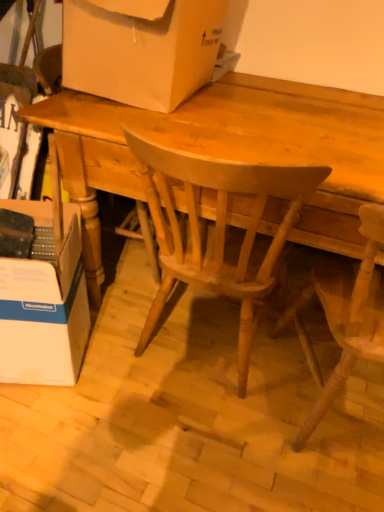
You are a GUI agent. You are given a task and a screenshot of the screen. Output one action in this format:
    pyautogui.click(x=<x>, y=<y>)
    Task: Click on the white cardboard box at left, which is counted as the 1th box, starting from the bottom
    
    Given the screenshot: What is the action you would take?
    pyautogui.click(x=44, y=294)

Measure the distance between point (360, 335) and camera.

Point (360, 335) is 1.08 meters away from camera.

Locate an element on the screen. wooden chair at center, which appears as the second chair when viewed from the left is located at coordinates click(346, 312).

At what (x,y) coordinates should I click in order to perform the action: click on light brown wood chair at center, the first chair viewed from the left. Please return your answer as a coordinate pair (x, y). Looking at the image, I should click on (216, 230).

Is wooden desk at center directly adjacent to white cardboard box at left, which is counted as the 1th box, starting from the bottom?

No.

Between wooden desk at center and white cardboard box at left, which is counted as the 1th box, starting from the bottom, which one is positioned in front?

Positioned in front is wooden desk at center.

Is wooden desk at center taller or shorter than white cardboard box at left, the second box positioned from the top?

Considering their sizes, wooden desk at center has more height than white cardboard box at left, the second box positioned from the top.

Can you confirm if wooden desk at center is positioned to the left of wooden chair at center, which appears as the second chair when viewed from the left?

Indeed, wooden desk at center is positioned on the left side of wooden chair at center, which appears as the second chair when viewed from the left.

From the image's perspective, would you say wooden desk at center is shown under wooden chair at center, which appears as the second chair when viewed from the left?

Actually, wooden desk at center appears above wooden chair at center, which appears as the second chair when viewed from the left, in the image.

Between wooden desk at center and wooden chair at center, arranged as the first chair when viewed from the right, which one is positioned behind?

Positioned behind is wooden desk at center.

Is wooden desk at center with wooden chair at center, arranged as the first chair when viewed from the right?

No.

Considering the relative sizes of wooden chair at center, which appears as the second chair when viewed from the left, and matte cardboard box at upper center, which is the first box in top-to-bottom order, in the image provided, is wooden chair at center, which appears as the second chair when viewed from the left, thinner than matte cardboard box at upper center, which is the first box in top-to-bottom order,?

In fact, wooden chair at center, which appears as the second chair when viewed from the left, might be wider than matte cardboard box at upper center, which is the first box in top-to-bottom order.

From a real-world perspective, is wooden chair at center, arranged as the first chair when viewed from the right, positioned over matte cardboard box at upper center, which is the first box in top-to-bottom order, based on gravity?

No, from a real-world perspective, wooden chair at center, arranged as the first chair when viewed from the right, is not on top of matte cardboard box at upper center, which is the first box in top-to-bottom order.

Which is closer to the camera, (365, 275) or (167, 88)?

Point (365, 275) is closer to the camera than point (167, 88).

Is wooden chair at center, which appears as the second chair when viewed from the left, bigger than matte cardboard box at upper center, acting as the second box starting from the bottom?

Yes.

Could you tell me if wooden desk at center is turned towards matte cardboard box at upper center, which is the first box in top-to-bottom order?

No, wooden desk at center does not turn towards matte cardboard box at upper center, which is the first box in top-to-bottom order.

Is matte cardboard box at upper center, which is the first box in top-to-bottom order, a part of wooden desk at center?

No, matte cardboard box at upper center, which is the first box in top-to-bottom order, is located outside of wooden desk at center.

Based on their positions, is wooden desk at center located to the left or right of matte cardboard box at upper center, which is the first box in top-to-bottom order?

In the image, wooden desk at center appears on the right side of matte cardboard box at upper center, which is the first box in top-to-bottom order.

Does point (281, 240) come farther from viewer compared to point (220, 115)?

That is False.

Are light brown wood chair at center, which appears as the second chair when viewed from the right, and wooden desk at center beside each other?

No, light brown wood chair at center, which appears as the second chair when viewed from the right, is not beside wooden desk at center.

This screenshot has height=512, width=384. I want to click on the 1st chair in front of the wooden desk at center, starting your count from the anchor, so click(216, 230).

Could you tell me if light brown wood chair at center, the first chair viewed from the left, is turned towards wooden desk at center?

Yes, light brown wood chair at center, the first chair viewed from the left, faces towards wooden desk at center.

Can you see matte cardboard box at upper center, acting as the second box starting from the bottom, touching wooden chair at center, which appears as the second chair when viewed from the left?

No, matte cardboard box at upper center, acting as the second box starting from the bottom, is not with wooden chair at center, which appears as the second chair when viewed from the left.

From the image's perspective, relative to wooden chair at center, which appears as the second chair when viewed from the left, is matte cardboard box at upper center, acting as the second box starting from the bottom, above or below?

Based on their image positions, matte cardboard box at upper center, acting as the second box starting from the bottom, is located above wooden chair at center, which appears as the second chair when viewed from the left.

Would you say matte cardboard box at upper center, acting as the second box starting from the bottom, is inside or outside wooden chair at center, which appears as the second chair when viewed from the left?

matte cardboard box at upper center, acting as the second box starting from the bottom, cannot be found inside wooden chair at center, which appears as the second chair when viewed from the left.

From the image's perspective, which object appears higher, matte cardboard box at upper center, which is the first box in top-to-bottom order, or light brown wood chair at center, the first chair viewed from the left?

matte cardboard box at upper center, which is the first box in top-to-bottom order, from the image's perspective.

Does matte cardboard box at upper center, acting as the second box starting from the bottom, have a larger size compared to light brown wood chair at center, which appears as the second chair when viewed from the right?

Actually, matte cardboard box at upper center, acting as the second box starting from the bottom, might be smaller than light brown wood chair at center, which appears as the second chair when viewed from the right.

Is matte cardboard box at upper center, acting as the second box starting from the bottom, positioned with its back to light brown wood chair at center, which appears as the second chair when viewed from the right?

That's not correct — matte cardboard box at upper center, acting as the second box starting from the bottom, is not looking away from light brown wood chair at center, which appears as the second chair when viewed from the right.

At what (x,y) coordinates should I click in order to perform the action: click on desk on the right of the white cardboard box at left, which is counted as the 1th box, starting from the bottom. Please return your answer as a coordinate pair (x, y). Looking at the image, I should click on (228, 149).

From a real-world perspective, starting from the wooden desk at center, which chair is the 1st one vertically above it? Please provide its 2D coordinates.

[(346, 312)]

From the image, which object appears to be nearer to matte cardboard box at upper center, which is the first box in top-to-bottom order, wooden desk at center or wooden chair at center, which appears as the second chair when viewed from the left?

wooden desk at center is positioned closer to the anchor matte cardboard box at upper center, which is the first box in top-to-bottom order.

Estimate the real-world distances between objects in this image. Which object is further from light brown wood chair at center, the first chair viewed from the left, wooden chair at center, which appears as the second chair when viewed from the left, or matte cardboard box at upper center, which is the first box in top-to-bottom order?

matte cardboard box at upper center, which is the first box in top-to-bottom order, is further to light brown wood chair at center, the first chair viewed from the left.

When comparing their distances from white cardboard box at left, the second box positioned from the top, does light brown wood chair at center, the first chair viewed from the left, or wooden chair at center, arranged as the first chair when viewed from the right, seem further?

wooden chair at center, arranged as the first chair when viewed from the right, lies further to white cardboard box at left, the second box positioned from the top, than the other object.

Based on their spatial positions, is light brown wood chair at center, which appears as the second chair when viewed from the right, or wooden desk at center further from white cardboard box at left, which is counted as the 1th box, starting from the bottom?

The object further to white cardboard box at left, which is counted as the 1th box, starting from the bottom, is wooden desk at center.

Considering their positions, is wooden desk at center positioned closer to white cardboard box at left, the second box positioned from the top, than light brown wood chair at center, the first chair viewed from the left?

light brown wood chair at center, the first chair viewed from the left, is positioned closer to the anchor white cardboard box at left, the second box positioned from the top.

Looking at the image, which one is located closer to light brown wood chair at center, the first chair viewed from the left, white cardboard box at left, the second box positioned from the top, or wooden chair at center, which appears as the second chair when viewed from the left?

The object closer to light brown wood chair at center, the first chair viewed from the left, is wooden chair at center, which appears as the second chair when viewed from the left.

When comparing their distances from matte cardboard box at upper center, acting as the second box starting from the bottom, does white cardboard box at left, which is counted as the 1th box, starting from the bottom, or wooden chair at center, which appears as the second chair when viewed from the left, seem closer?

white cardboard box at left, which is counted as the 1th box, starting from the bottom.

Based on the photo, based on their spatial positions, is wooden desk at center or wooden chair at center, arranged as the first chair when viewed from the right, closer to white cardboard box at left, which is counted as the 1th box, starting from the bottom?

Among the two, wooden desk at center is located nearer to white cardboard box at left, which is counted as the 1th box, starting from the bottom.

Locate an element on the screen. The image size is (384, 512). box located between white cardboard box at left, which is counted as the 1th box, starting from the bottom, and wooden chair at center, arranged as the first chair when viewed from the right, in the left-right direction is located at coordinates (141, 51).

The height and width of the screenshot is (512, 384). I want to click on chair that lies between matte cardboard box at upper center, which is the first box in top-to-bottom order, and wooden chair at center, arranged as the first chair when viewed from the right, from top to bottom, so click(x=216, y=230).

Image resolution: width=384 pixels, height=512 pixels. I want to click on chair situated between white cardboard box at left, which is counted as the 1th box, starting from the bottom, and wooden chair at center, which appears as the second chair when viewed from the left, from left to right, so click(216, 230).

Where is `desk between white cardboard box at left, the second box positioned from the top, and wooden chair at center, which appears as the second chair when viewed from the left, from left to right`? This screenshot has height=512, width=384. desk between white cardboard box at left, the second box positioned from the top, and wooden chair at center, which appears as the second chair when viewed from the left, from left to right is located at coordinates (228, 149).